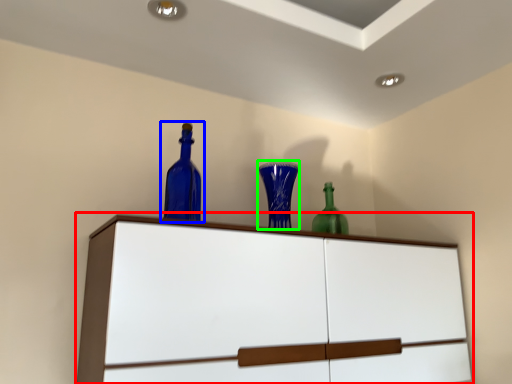
Question: Estimate the real-world distances between objects in this image. Which object is farther from cupboard (highlighted by a red box), bottle (highlighted by a blue box) or glass vase (highlighted by a green box)?

Choices:
 (A) bottle
 (B) glass vase

Answer: (A)